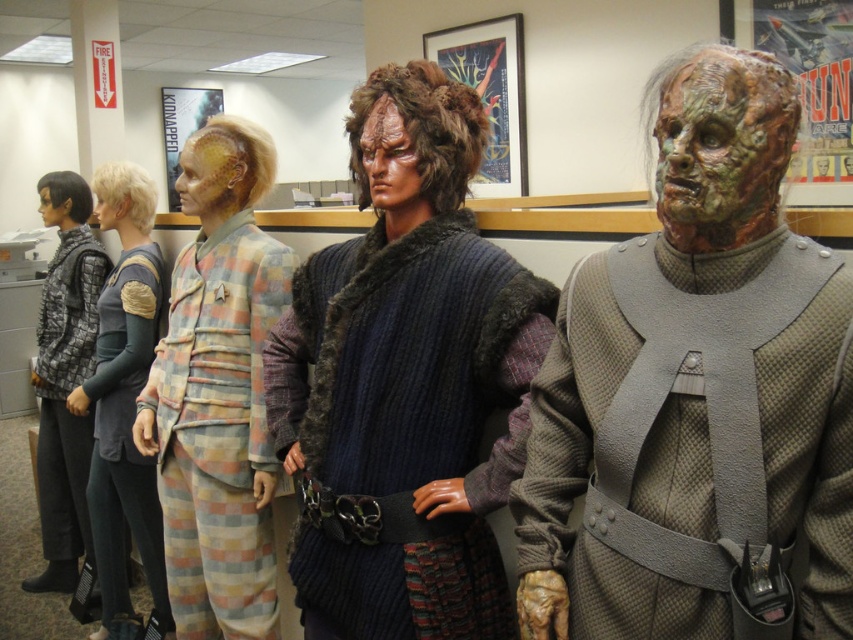
You are an artist trying to paint the mannequins in the image. You need to decide which part of the mannequin to paint first based on their positions. Which object is taller between the dark blue knitted vest at center and the yellowish skin at center?

The dark blue knitted vest at center is taller than the yellowish skin at center, so you should paint the dark blue knitted vest at center first as it is taller.

You are standing in the exhibit hall and want to take a photo of both point coordinates, point (422, 314) and point (222, 193). Which point should you focus on first to ensure both are in frame?

Point (422, 314) is in front of point (222, 193), so you should focus on point (422, 314) first to ensure both are in frame.